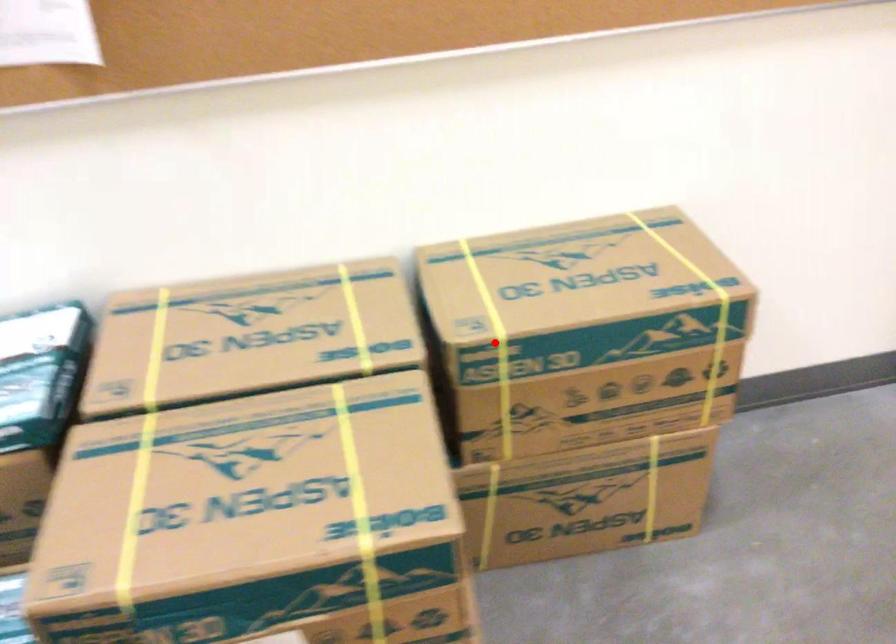
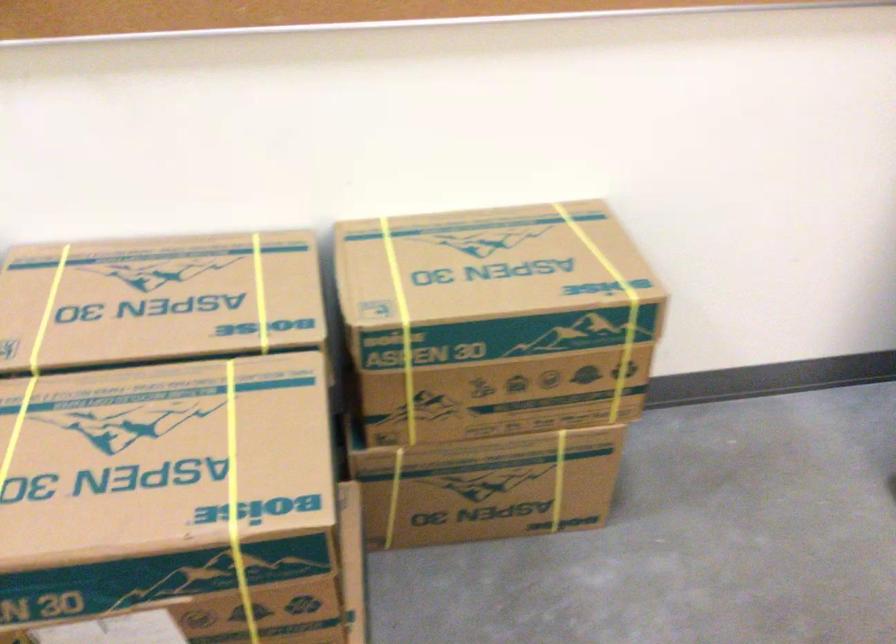
Find the pixel in the second image that matches the highlighted location in the first image.

(401, 327)